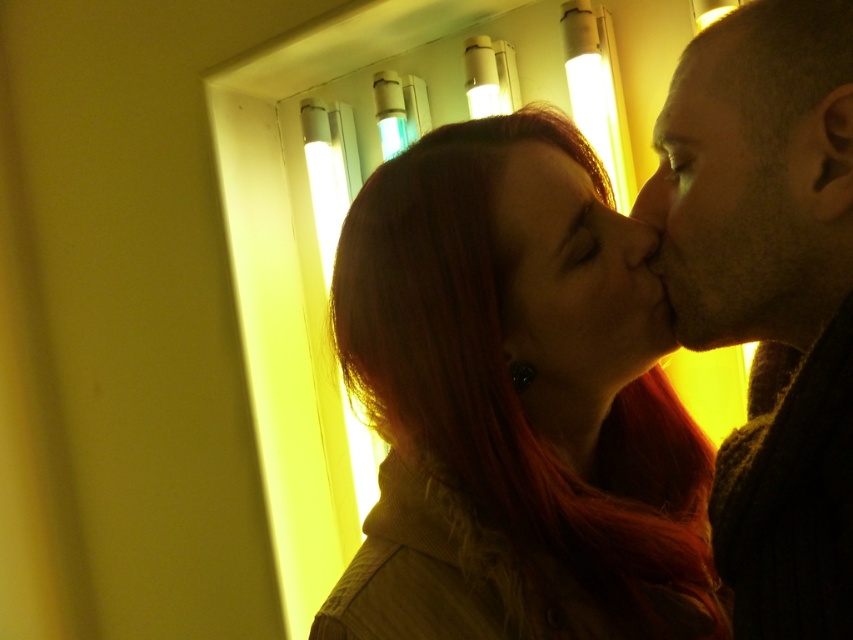
Measure the distance between dark brown hair at right and smooth skin face at right.

They are 1.34 inches apart.

Is dark brown hair at right behind smooth skin face at right?

No.

Does point (834, 522) come in front of point (689, 216)?

Yes, it is in front of point (689, 216).

At what (x,y) coordinates should I click in order to perform the action: click on dark brown hair at right. Please return your answer as a coordinate pair (x, y). Looking at the image, I should click on (770, 296).

Does smooth skin face at right have a smaller size compared to matte red hair at center?

No, smooth skin face at right is not smaller than matte red hair at center.

Can you confirm if smooth skin face at right is positioned below matte red hair at center?

Actually, smooth skin face at right is above matte red hair at center.

Does point (741, 100) come in front of point (616, 230)?

That is True.

Locate an element on the screen. This screenshot has width=853, height=640. smooth skin face at right is located at coordinates (741, 208).

Measure the distance between smooth skin face at right and camera.

smooth skin face at right and camera are 55.47 centimeters apart.

Can you confirm if smooth skin face at right is shorter than matte skin nose at right?

Incorrect, smooth skin face at right's height does not fall short of matte skin nose at right's.

Identify the location of smooth skin face at right. (741, 208).